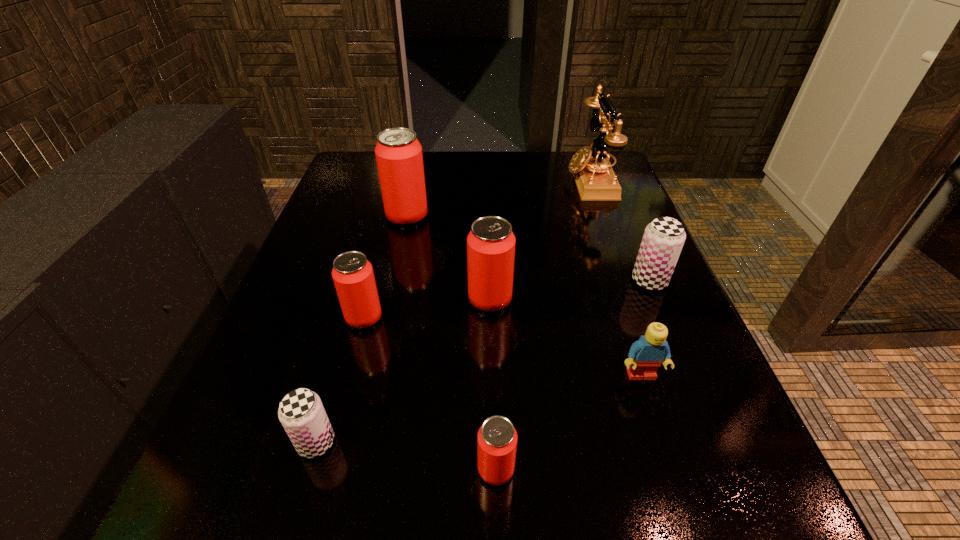
Locate an element on the screen. free space that satisfies the following two spatial constraints: 1. on the back side of the right purple beer can; 2. on the right side of the nearer purple beer can is located at coordinates (363, 281).

Locate an element on the screen. Image resolution: width=960 pixels, height=540 pixels. vacant area that satisfies the following two spatial constraints: 1. on the front side of the smallest red beer can; 2. on the right side of the left purple beer can is located at coordinates (308, 469).

This screenshot has height=540, width=960. I want to click on vacant space that satisfies the following two spatial constraints: 1. on the back side of the nearer purple beer can; 2. on the left side of the second tallest beer can, so tap(358, 300).

In order to click on free space that satisfies the following two spatial constraints: 1. on the front side of the third smallest red beer can; 2. on the right side of the smallest red beer can in this screenshot , I will do `click(494, 469)`.

The image size is (960, 540). I want to click on free space that satisfies the following two spatial constraints: 1. on the dial of the telephone; 2. on the front side of the left purple beer can, so click(x=685, y=442).